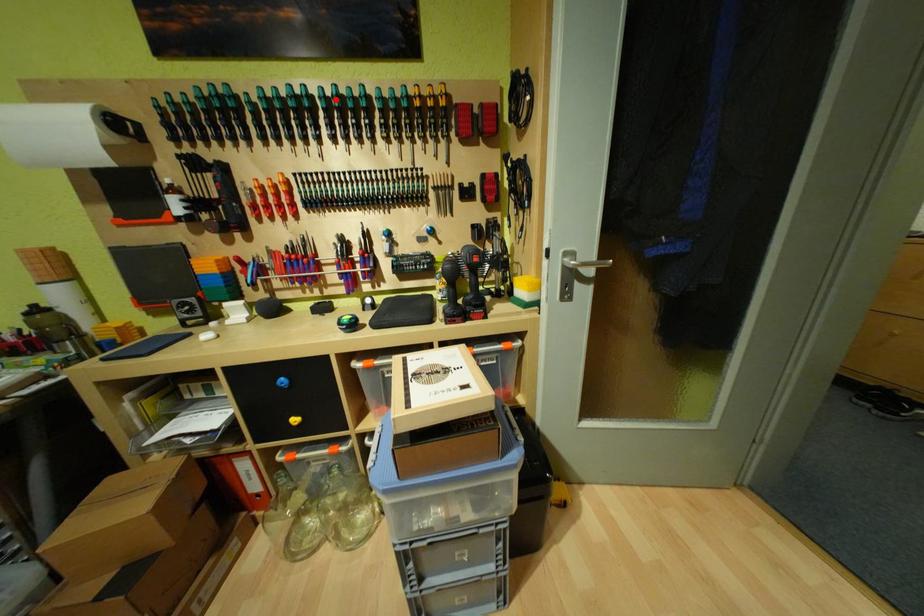
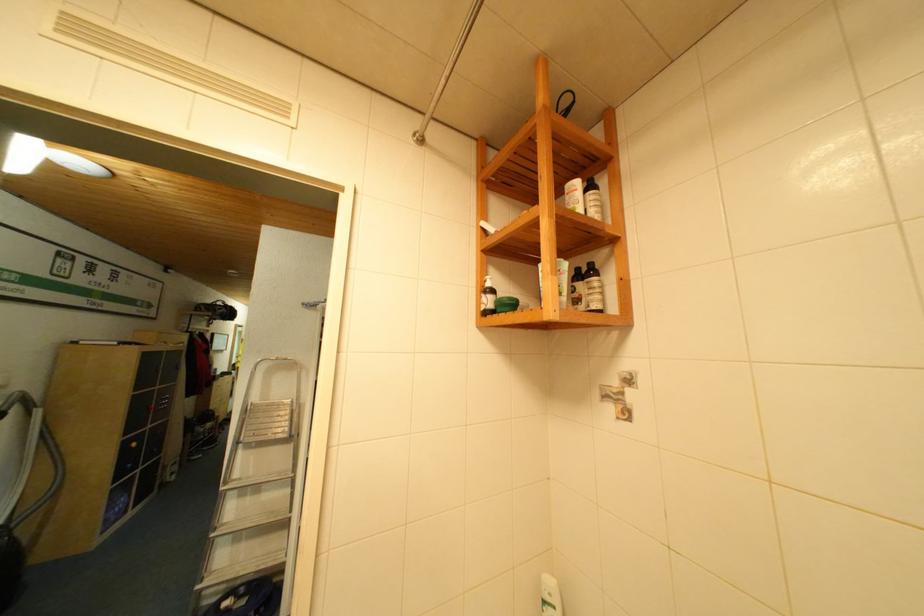
Question: I am providing you with two images of the same scene from different viewpoints. A red point is marked on the first image. At the location where the point appears in image 1, is it still visible in image 2?

Choices:
 (A) Yes
 (B) No

Answer: (B)